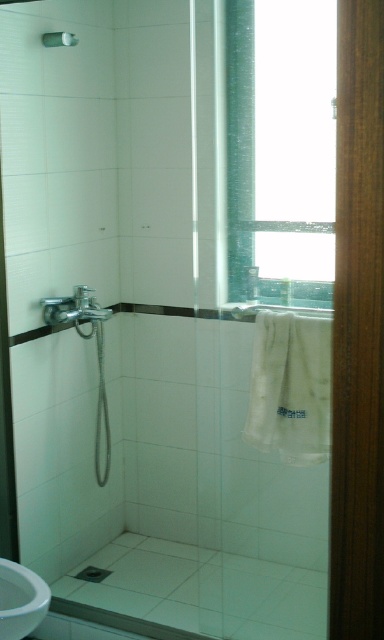
Question: Which of the following is the farthest from the observer?

Choices:
 (A) white glossy sink at lower left
 (B) brushed metal faucet at left

Answer: (B)

Question: Does transparent glass window at upper center lie behind brushed metal faucet at left?

Choices:
 (A) yes
 (B) no

Answer: (B)

Question: Based on their relative distances, which object is farther from the silver metallic towel bar at upper center?

Choices:
 (A) transparent glass window at upper center
 (B) white glossy sink at lower left

Answer: (B)

Question: Can you confirm if white glossy sink at lower left is positioned above silver metallic towel bar at upper center?

Choices:
 (A) no
 (B) yes

Answer: (A)

Question: Does white glossy sink at lower left have a larger size compared to brushed metal faucet at left?

Choices:
 (A) yes
 (B) no

Answer: (B)

Question: Which of the following is the farthest from the observer?

Choices:
 (A) (18, 577)
 (B) (291, 109)
 (C) (86, 336)
 (D) (69, 38)

Answer: (C)